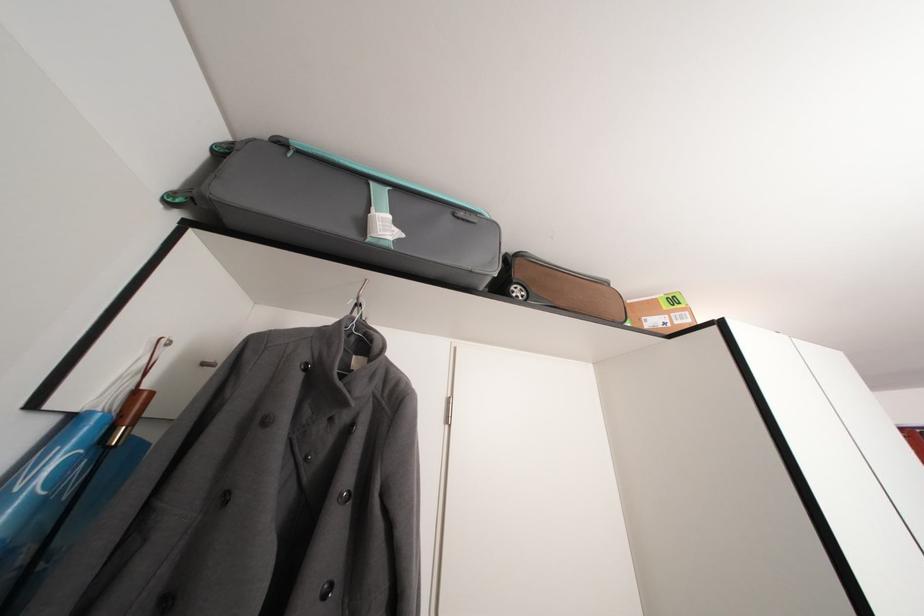
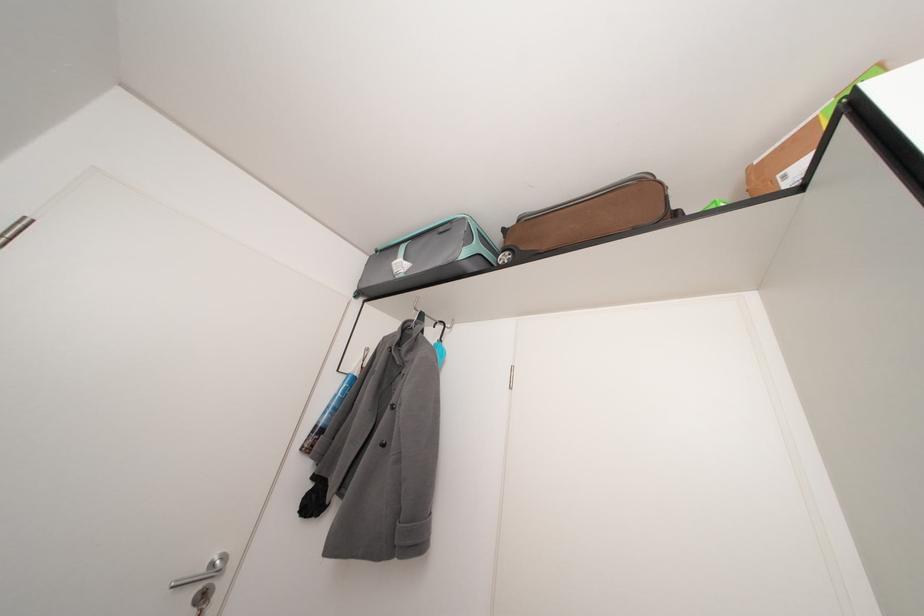
In the second image, find the point that corresponds to (x=302, y=148) in the first image.

(386, 254)